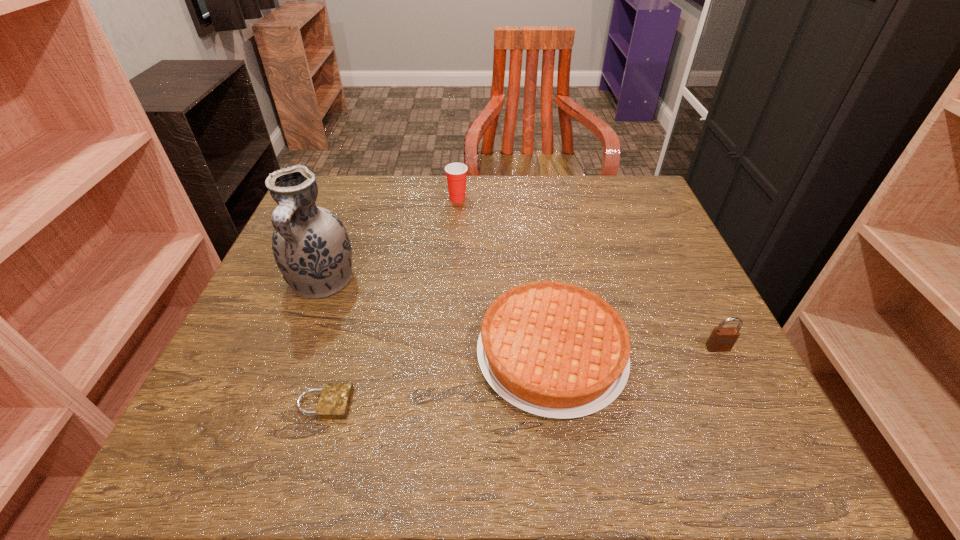
Where is `free spot that satisfies the following two spatial constraints: 1. on the front side of the farthest object; 2. on the keyhole side of the nearer padlock`? free spot that satisfies the following two spatial constraints: 1. on the front side of the farthest object; 2. on the keyhole side of the nearer padlock is located at coordinates (444, 403).

This screenshot has height=540, width=960. Find the location of `free space that satisfies the following two spatial constraints: 1. on the front side of the Dixie cup; 2. on the keyhole side of the nearer padlock`. free space that satisfies the following two spatial constraints: 1. on the front side of the Dixie cup; 2. on the keyhole side of the nearer padlock is located at coordinates (444, 403).